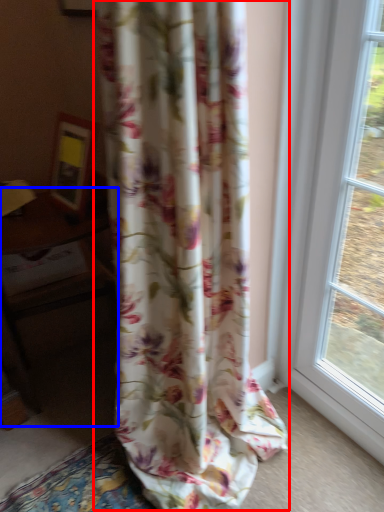
Question: Which object is closer to the camera taking this photo, curtain (highlighted by a red box) or table (highlighted by a blue box)?

Choices:
 (A) curtain
 (B) table

Answer: (A)